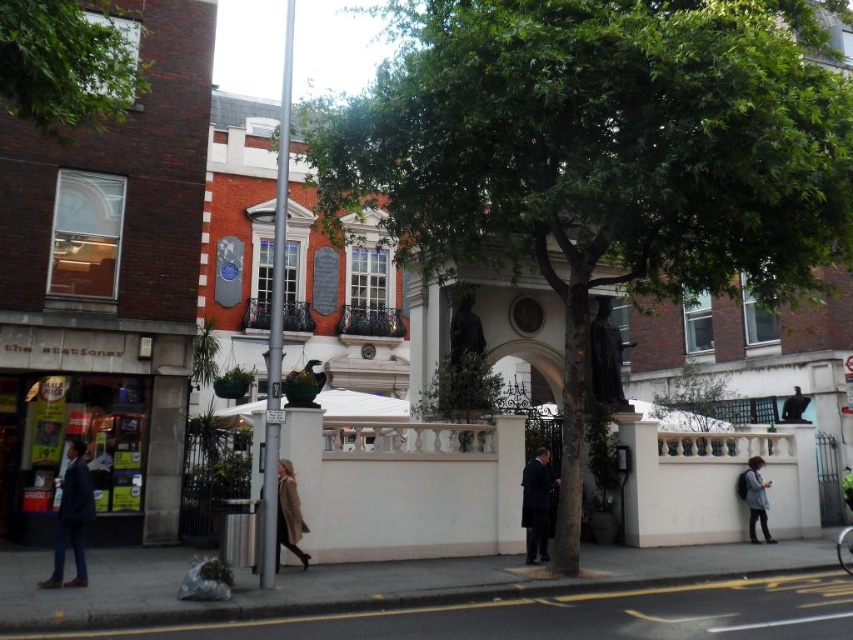
Question: Is dark gray backpack at lower right thinner than dark blue suit at center?

Choices:
 (A) yes
 (B) no

Answer: (A)

Question: Does green leafy tree at center appear on the right side of brown wool coat at center?

Choices:
 (A) no
 (B) yes

Answer: (B)

Question: Which of the following is the closest to the observer?

Choices:
 (A) brown wool coat at center
 (B) dark brown statue at center
 (C) dark blue suit at center

Answer: (A)

Question: Which of these objects is positioned farthest from the green leafy tree at center?

Choices:
 (A) dark blue jacket at lower left
 (B) dark brown statue at center

Answer: (A)

Question: Can you confirm if green leafy tree at upper left is positioned to the left of dark blue suit at center?

Choices:
 (A) no
 (B) yes

Answer: (B)

Question: Which point is closer to the camera?

Choices:
 (A) dark gray backpack at lower right
 (B) dark brown statue at center
 (C) dark blue jacket at lower left
 (D) brown wool coat at center

Answer: (C)